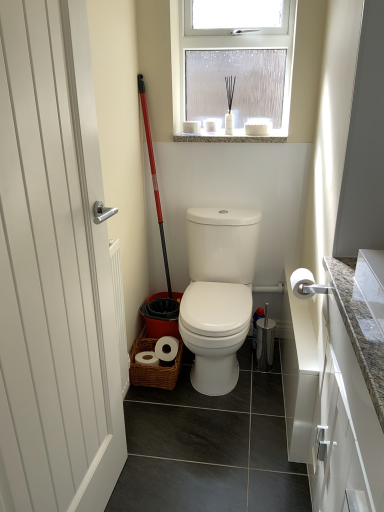
Question: Which is correct: red plastic shovel at center is inside white glossy toilet at center, or outside of it?

Choices:
 (A) outside
 (B) inside

Answer: (A)

Question: Looking at the image, does red plastic shovel at center seem bigger or smaller compared to white glossy toilet at center?

Choices:
 (A) small
 (B) big

Answer: (A)

Question: Estimate the real-world distances between objects in this image. Which object is farther from the white glossy door at left?

Choices:
 (A) granite at upper center
 (B) red plastic shovel at center
 (C) white glossy toilet at center
 (D) clear frosted glass at upper center
 (E) white matte toilet paper at right

Answer: (D)

Question: Which of these objects is positioned farthest from the red plastic shovel at center?

Choices:
 (A) white glossy toilet at center
 (B) granite at upper center
 (C) white glossy door at left
 (D) white matte toilet paper at right
 (E) clear frosted glass at upper center

Answer: (C)